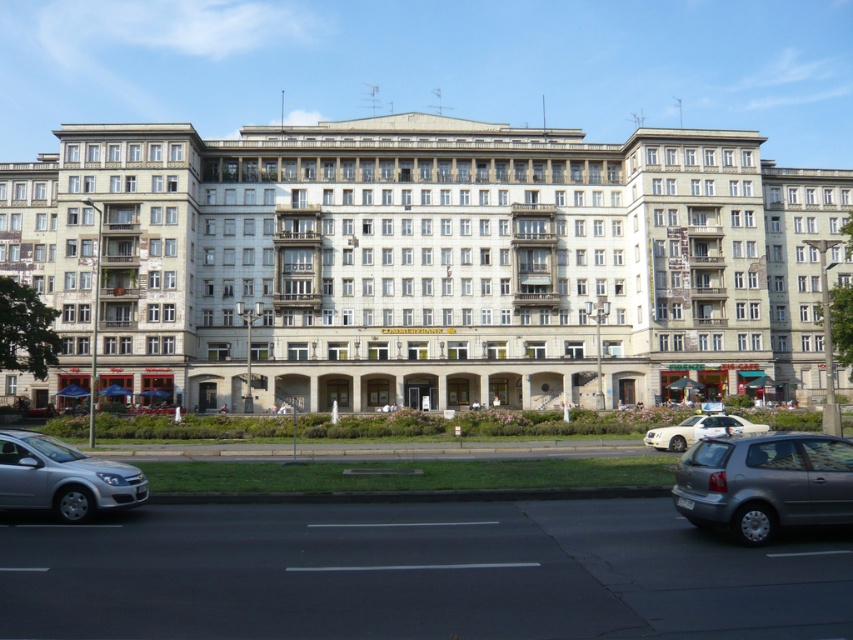
Question: Is silver metallic hatchback at lower right to the left of silver metallic sedan at lower left from the viewer's perspective?

Choices:
 (A) no
 (B) yes

Answer: (A)

Question: Estimate the real-world distances between objects in this image. Which object is farther from the silver metallic sedan at lower left?

Choices:
 (A) white glossy sedan at center
 (B) white concrete building at center

Answer: (B)

Question: Is white concrete building at center in front of silver metallic sedan at lower left?

Choices:
 (A) yes
 (B) no

Answer: (B)

Question: Is silver metallic hatchback at lower right to the left of silver metallic sedan at lower left from the viewer's perspective?

Choices:
 (A) yes
 (B) no

Answer: (B)

Question: Which point appears closest to the camera in this image?

Choices:
 (A) (686, 472)
 (B) (422, 301)

Answer: (A)

Question: Considering the real-world distances, which object is closest to the silver metallic sedan at lower left?

Choices:
 (A) white glossy sedan at center
 (B) silver metallic hatchback at lower right

Answer: (B)